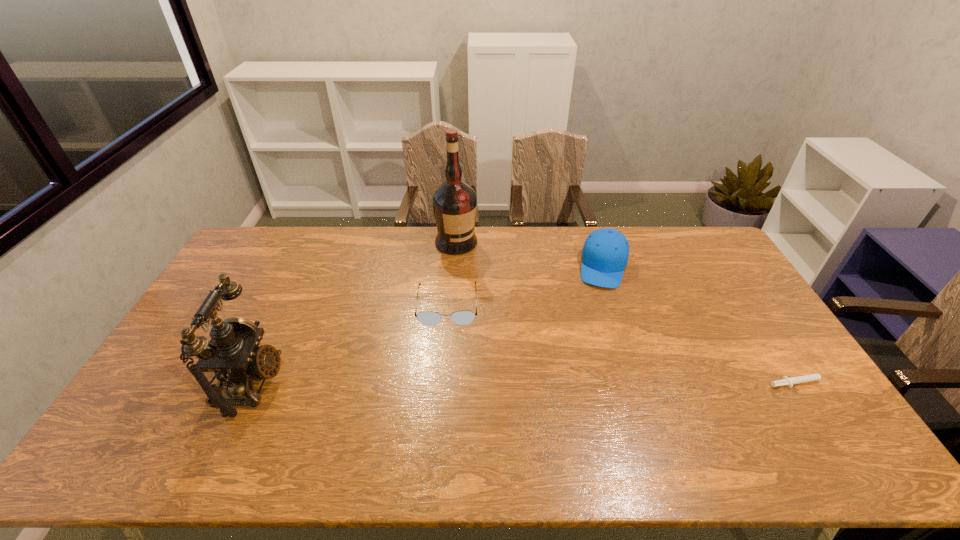
This screenshot has width=960, height=540. What are the coordinates of `vacant region that satisfies the following two spatial constraints: 1. on the back side of the liquor; 2. on the right side of the spectacles` in the screenshot? It's located at pyautogui.click(x=452, y=242).

The width and height of the screenshot is (960, 540). Identify the location of vacant region that satisfies the following two spatial constraints: 1. on the front side of the syringe; 2. on the right side of the second shortest object. (442, 383).

Where is `free space that satisfies the following two spatial constraints: 1. on the front side of the second object from right to left; 2. on the right side of the rightmost object`? free space that satisfies the following two spatial constraints: 1. on the front side of the second object from right to left; 2. on the right side of the rightmost object is located at coordinates pos(642,383).

The width and height of the screenshot is (960, 540). I want to click on vacant space that satisfies the following two spatial constraints: 1. on the back side of the fourth tallest object; 2. on the left side of the cap, so tap(450, 266).

Find the location of a particular element. free space in the image that satisfies the following two spatial constraints: 1. on the front side of the rightmost object; 2. on the left side of the tallest object is located at coordinates (447, 383).